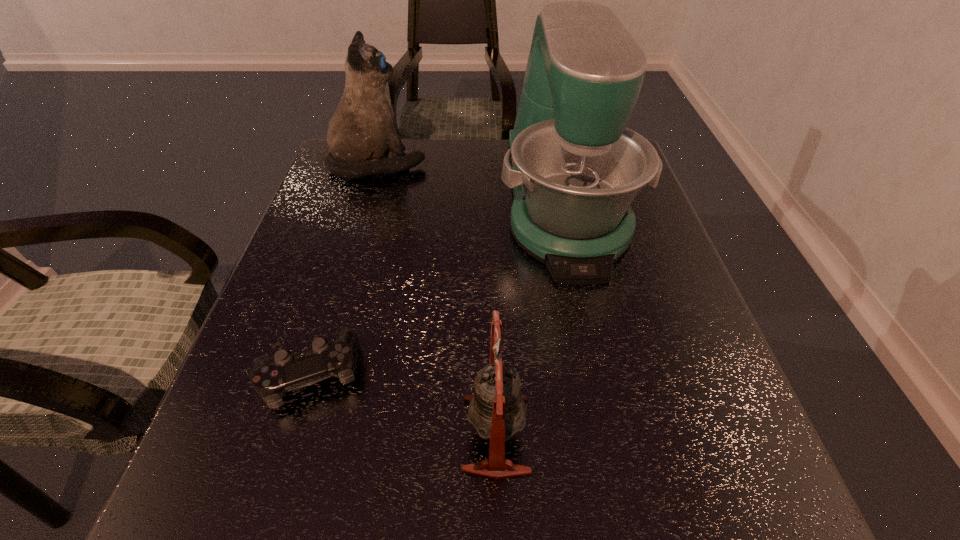
Locate an element on the screen. The height and width of the screenshot is (540, 960). free space between the third shortest object and the shortest object is located at coordinates (343, 268).

Image resolution: width=960 pixels, height=540 pixels. What are the coordinates of `the closest object relative to the mixer` in the screenshot? It's located at (363, 130).

Point out which object is positioned as the nearest to the control. Please provide its 2D coordinates. Your answer should be formatted as a tuple, i.e. [(x, y)], where the tuple contains the x and y coordinates of a point satisfying the conditions above.

[(497, 410)]

Find the location of `vacant position in the image that satisfies the following two spatial constraints: 1. at the face of the second tallest object; 2. on the front side of the shortest object`. vacant position in the image that satisfies the following two spatial constraints: 1. at the face of the second tallest object; 2. on the front side of the shortest object is located at coordinates (314, 373).

Where is `free spot that satisfies the following two spatial constraints: 1. at the face of the cat; 2. on the front side of the shortest object`? The width and height of the screenshot is (960, 540). free spot that satisfies the following two spatial constraints: 1. at the face of the cat; 2. on the front side of the shortest object is located at coordinates (314, 373).

Find the location of a particular element. vacant area in the image that satisfies the following two spatial constraints: 1. at the face of the third tallest object; 2. on the left side of the cat is located at coordinates (297, 434).

Identify the location of free space in the image that satisfies the following two spatial constraints: 1. on the front side of the control; 2. on the left side of the second shortest object. The image size is (960, 540). (290, 434).

At what (x,y) coordinates should I click in order to perform the action: click on vacant area that satisfies the following two spatial constraints: 1. at the face of the second tallest object; 2. on the left side of the second shortest object. Please return your answer as a coordinate pair (x, y). Looking at the image, I should click on (297, 434).

Where is `free space that satisfies the following two spatial constraints: 1. at the face of the third tallest object; 2. on the right side of the second tallest object`? free space that satisfies the following two spatial constraints: 1. at the face of the third tallest object; 2. on the right side of the second tallest object is located at coordinates (297, 434).